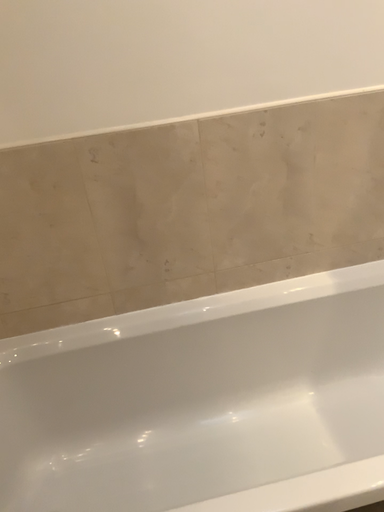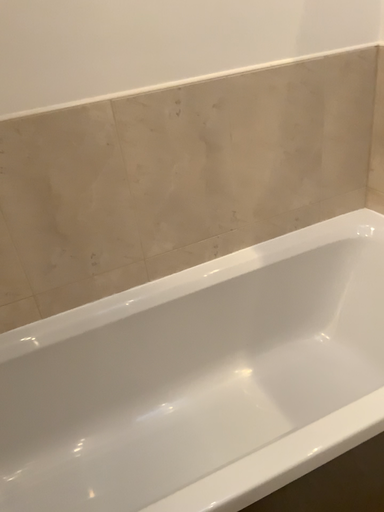
Question: How did the camera likely rotate when shooting the video?

Choices:
 (A) rotated left
 (B) rotated right

Answer: (B)